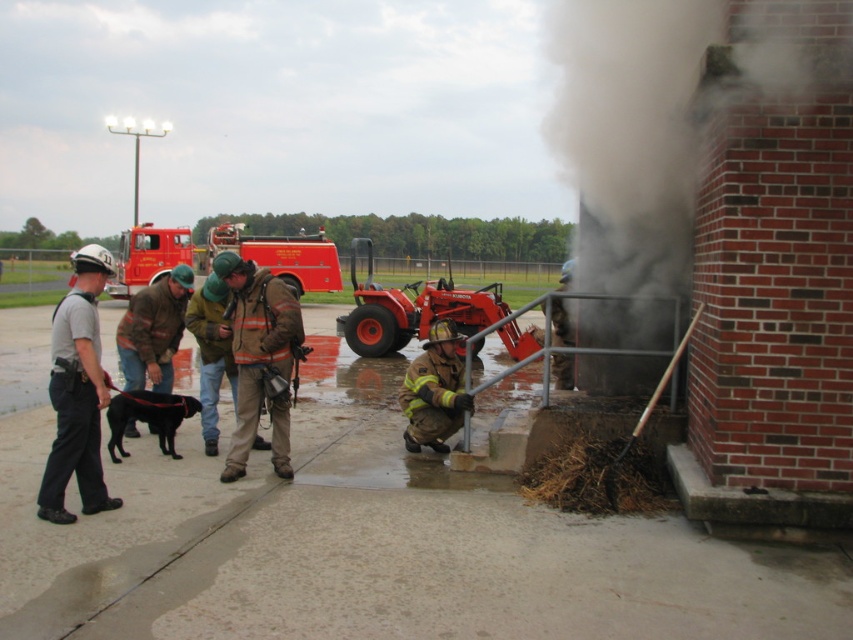
Question: Which point is farther to the camera?

Choices:
 (A) (171, 353)
 (B) (666, 38)
 (C) (422, 394)

Answer: (A)

Question: Is brown fuzzy jacket at left positioned in front of camouflage jacket at center?

Choices:
 (A) yes
 (B) no

Answer: (B)

Question: Can you confirm if matte red tractor at center is bigger than hard hat firefighter at lower right?

Choices:
 (A) yes
 (B) no

Answer: (B)

Question: Observing the image, what is the correct spatial positioning of black smoke at right in reference to camouflage jacket at center?

Choices:
 (A) left
 (B) right

Answer: (B)

Question: Based on their relative distances, which object is farther from the black smoke at right?

Choices:
 (A) brown/cotton jacket at center
 (B) camouflage jacket at center
 (C) firefighter uniform at lower center

Answer: (B)

Question: Which of the following is the farthest from the observer?

Choices:
 (A) (602, 225)
 (B) (67, 467)
 (C) (567, 282)
 (D) (433, 342)

Answer: (C)